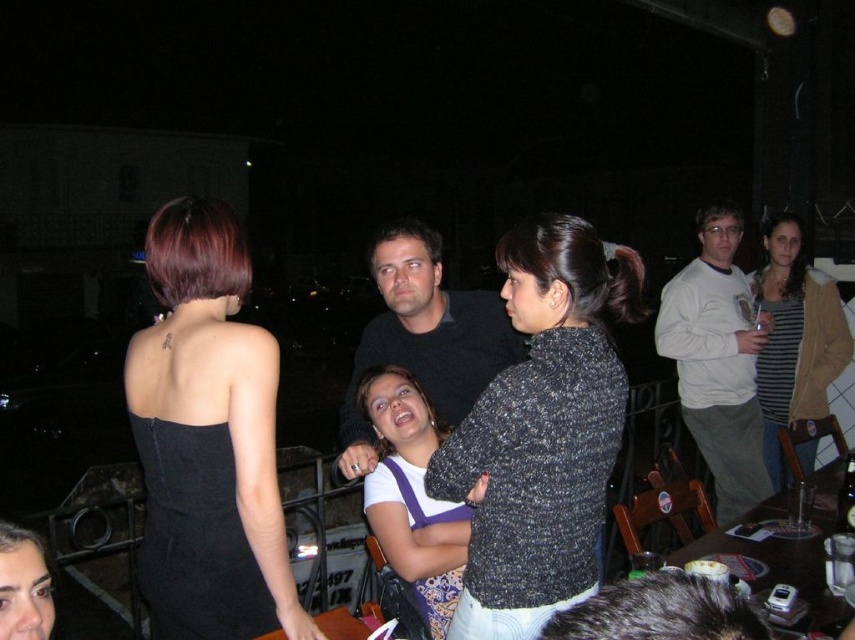
You are a photographer at this event and want to capture a photo of both the striped knit sweater at upper right and the matte black dress at center. Which object should you focus on first to ensure both are in frame?

The striped knit sweater at upper right is above the matte black dress at center, so you should focus on the striped knit sweater at upper right first to ensure both are in frame.

You are a photographer setting up for an event. You have a camera with a 1.2 meter wide lens. You need to capture both the striped knit sweater at upper right and the matte black dress at center in the same frame. Can you fit both items into the frame without moving the camera?

The striped knit sweater at upper right might be wider than matte black dress at center. However, since the exact width isn t specified, it s possible that the total width required could be more than 1.2 meters. Without knowing the exact dimensions, it s uncertain if both can fit within the camera s 1.2 meter wide lens frame.

You are a photographer setting up for an event. You need to position a spotlight that can cover both the black matte dress at upper left and the speckled sweater at center. Considering their sizes, which object requires a larger spotlight to fully illuminate?

The speckled sweater at center requires a larger spotlight because it occupies more space than the black matte dress at upper left.